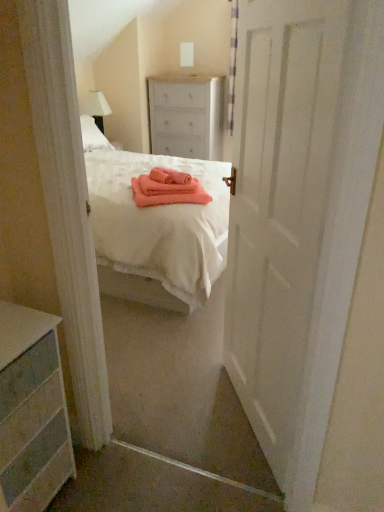
Question: Is the depth of pink fabric at center greater than that of white painted wood dresser at lower left, which is counted as the 1th chest of drawers, starting from the left?

Choices:
 (A) no
 (B) yes

Answer: (B)

Question: Considering the relative sizes of pink fabric at center and white painted wood dresser at lower left, the second chest of drawers when ordered from top to bottom, in the image provided, is pink fabric at center taller than white painted wood dresser at lower left, the second chest of drawers when ordered from top to bottom,?

Choices:
 (A) yes
 (B) no

Answer: (B)

Question: Is pink fabric at center positioned beyond the bounds of white painted wood dresser at lower left, the second chest of drawers when ordered from top to bottom?

Choices:
 (A) no
 (B) yes

Answer: (B)

Question: From a real-world perspective, is pink fabric at center positioned under white painted wood dresser at lower left, the second chest of drawers when ordered from top to bottom, based on gravity?

Choices:
 (A) no
 (B) yes

Answer: (A)

Question: Are pink fabric at center and white painted wood dresser at lower left, arranged as the first chest of drawers when viewed from the front, making contact?

Choices:
 (A) no
 (B) yes

Answer: (A)

Question: Considering the relative positions of pink fabric at center and white painted wood dresser at lower left, arranged as the first chest of drawers when viewed from the front, in the image provided, is pink fabric at center to the right of white painted wood dresser at lower left, arranged as the first chest of drawers when viewed from the front, from the viewer's perspective?

Choices:
 (A) yes
 (B) no

Answer: (A)

Question: From the image's perspective, is white matte door at center below white painted wood dresser at lower left, marked as the second chest of drawers in a right-to-left arrangement?

Choices:
 (A) yes
 (B) no

Answer: (B)

Question: From a real-world perspective, is white matte door at center located beneath white painted wood dresser at lower left, placed as the second chest of drawers when sorted from back to front?

Choices:
 (A) no
 (B) yes

Answer: (A)

Question: Can you confirm if white matte door at center is positioned to the left of white painted wood dresser at lower left, the 1th chest of drawers positioned from the bottom?

Choices:
 (A) yes
 (B) no

Answer: (B)

Question: From a real-world perspective, is white matte door at center positioned over white painted wood dresser at lower left, which is counted as the 1th chest of drawers, starting from the left, based on gravity?

Choices:
 (A) yes
 (B) no

Answer: (A)

Question: Is white matte door at center oriented away from white painted wood dresser at lower left, marked as the second chest of drawers in a right-to-left arrangement?

Choices:
 (A) no
 (B) yes

Answer: (A)

Question: Is the position of white matte door at center more distant than that of white painted wood dresser at lower left, the second chest of drawers when ordered from top to bottom?

Choices:
 (A) yes
 (B) no

Answer: (B)

Question: From the image's perspective, does white painted wood chest of drawers at center, which appears as the second chest of drawers when viewed from the front, appear higher than pink fabric at center?

Choices:
 (A) no
 (B) yes

Answer: (B)